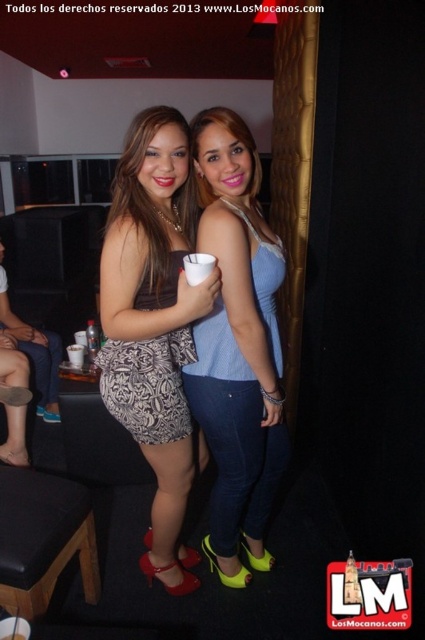
Does patterned fabric skirt at center come behind black leather stool at lower left?

No.

Does patterned fabric skirt at center have a lesser width compared to black leather stool at lower left?

No, patterned fabric skirt at center is not thinner than black leather stool at lower left.

Where is `patterned fabric skirt at center`? This screenshot has height=640, width=425. patterned fabric skirt at center is located at coordinates (153, 323).

Is blue denim jeans at center positioned at the back of black leather stool at lower left?

No.

Between point (227, 484) and point (11, 490), which one is positioned in front?

Point (11, 490)

Identify the location of blue denim jeans at center. The width and height of the screenshot is (425, 640). (238, 346).

Between patterned fabric skirt at center and blue denim jeans at center, which one has more height?

Standing taller between the two is patterned fabric skirt at center.

Is point (161, 408) closer to camera compared to point (280, 372)?

That is True.

The width and height of the screenshot is (425, 640). What are the coordinates of `patterned fabric skirt at center` in the screenshot? It's located at (153, 323).